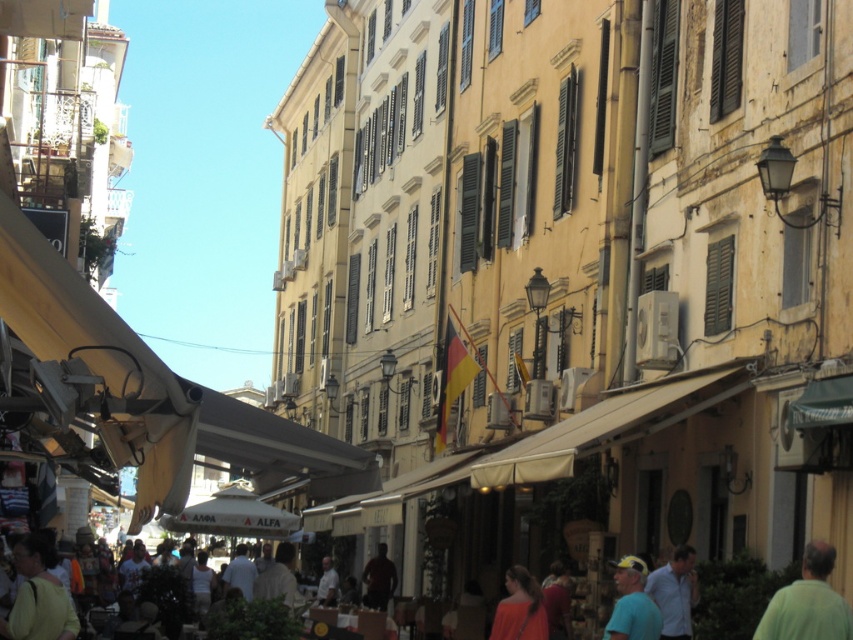
Question: Is orange fabric shirt at lower center to the right of dark brown leather jacket at center from the viewer's perspective?

Choices:
 (A) yes
 (B) no

Answer: (A)

Question: Does yellow cap at lower right have a larger size compared to light brown leather jacket at center?

Choices:
 (A) no
 (B) yes

Answer: (A)

Question: Which object appears closest to the camera in this image?

Choices:
 (A) light brown leather jacket at center
 (B) green matte shirt at lower right
 (C) dark brown leather jacket at center
 (D) light blue shirt at lower right

Answer: (B)

Question: Which is farther from the green matte shirt at lower right?

Choices:
 (A) light brown fabric bag at lower left
 (B) light blue shirt at lower right

Answer: (A)

Question: Observing the image, what is the correct spatial positioning of yellow cap at lower right in reference to light brown leather jacket at center?

Choices:
 (A) above
 (B) below

Answer: (A)

Question: Estimate the real-world distances between objects in this image. Which object is farther from the light brown fabric bag at lower left?

Choices:
 (A) green matte shirt at lower right
 (B) dark brown leather jacket at center

Answer: (B)